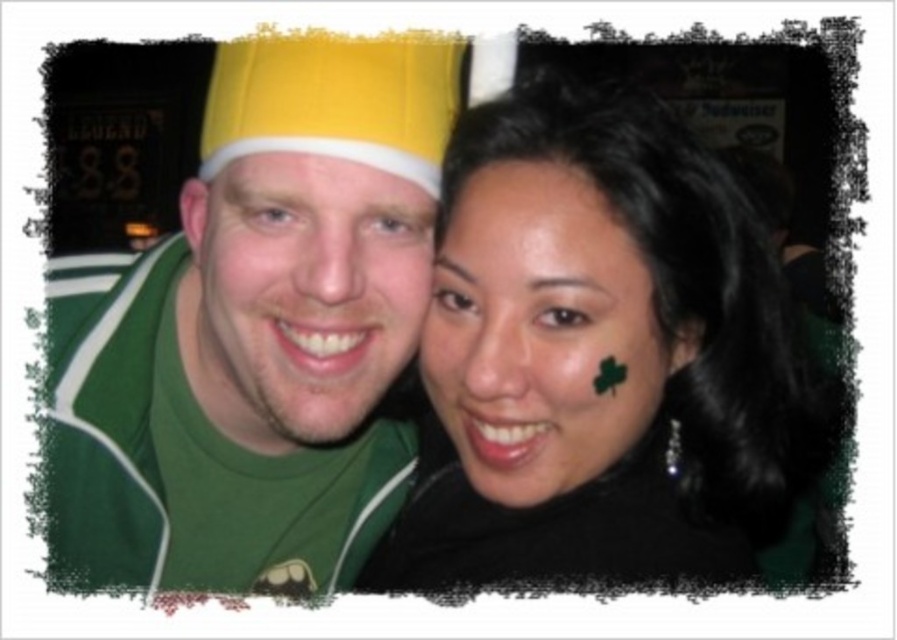
Question: Which of the following is the farthest from the observer?

Choices:
 (A) green matte face paint at center
 (B) yellow fabric hat at upper left

Answer: (B)

Question: Is matte yellow hat at center smaller than green matte face at center?

Choices:
 (A) yes
 (B) no

Answer: (B)

Question: Can you confirm if green matte face paint at center is smaller than green matte forehead at upper center?

Choices:
 (A) no
 (B) yes

Answer: (A)

Question: Which point is farther to the camera?

Choices:
 (A) matte yellow cap at center
 (B) green matte forehead at upper center
 (C) green matte face at center
 (D) green matte face paint at center

Answer: (B)

Question: Which point appears farthest from the camera in this image?

Choices:
 (A) (225, 134)
 (B) (266, 138)

Answer: (A)

Question: Can you confirm if green matte face at center is thinner than matte yellow cap at center?

Choices:
 (A) no
 (B) yes

Answer: (A)